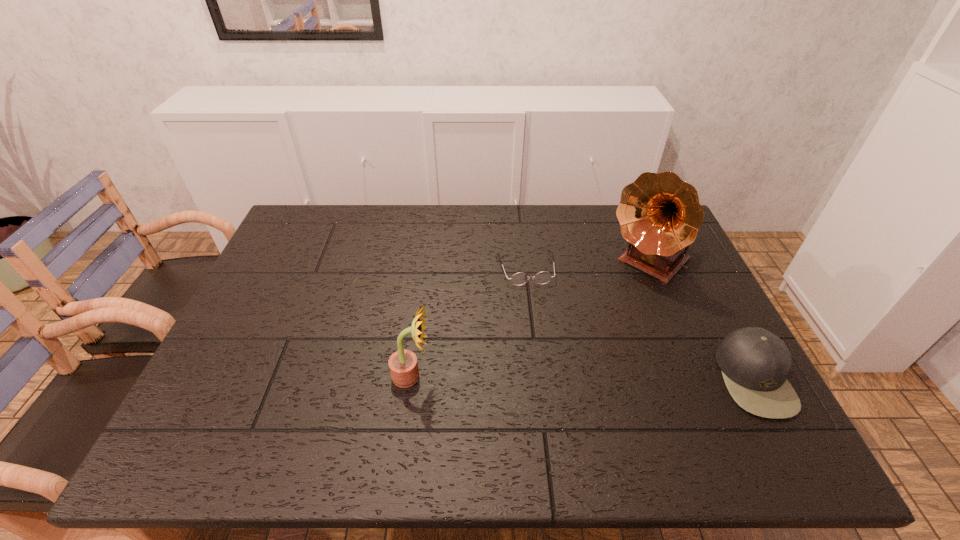
Locate which object is the third closest to the third tallest object. Please provide its 2D coordinates. Your answer should be formatted as a tuple, i.e. [(x, y)], where the tuple contains the x and y coordinates of a point satisfying the conditions above.

[(403, 365)]

Where is `vacant region that satisfies the following two spatial constraints: 1. on the front side of the cap; 2. on the brim of the phonograph_record`? The height and width of the screenshot is (540, 960). vacant region that satisfies the following two spatial constraints: 1. on the front side of the cap; 2. on the brim of the phonograph_record is located at coordinates (697, 378).

Locate an element on the screen. free point that satisfies the following two spatial constraints: 1. on the front side of the third object from right to left; 2. on the brim of the cap is located at coordinates (539, 378).

Image resolution: width=960 pixels, height=540 pixels. Find the location of `vacant space that satisfies the following two spatial constraints: 1. on the front side of the phonograph_record; 2. on the brim of the cap`. vacant space that satisfies the following two spatial constraints: 1. on the front side of the phonograph_record; 2. on the brim of the cap is located at coordinates pyautogui.click(x=697, y=378).